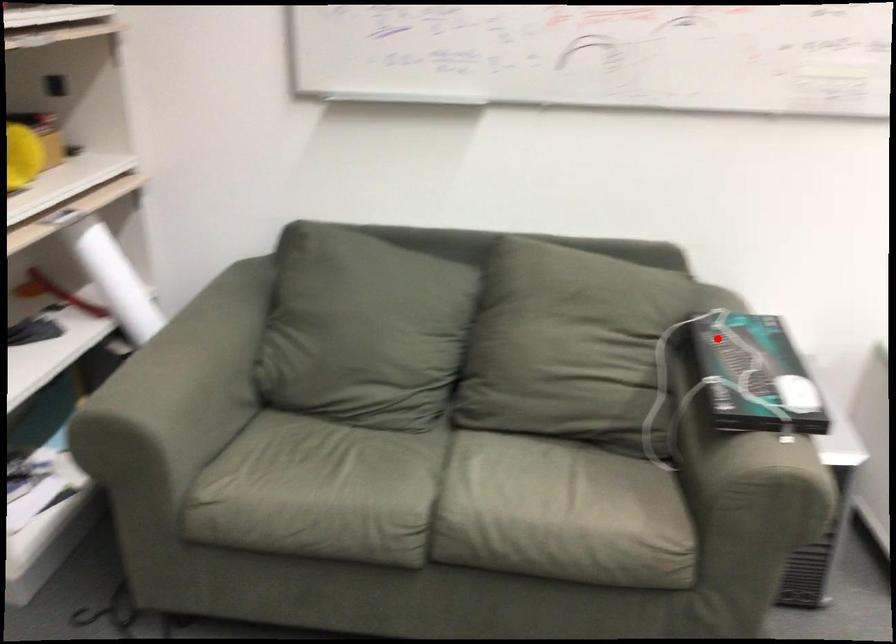
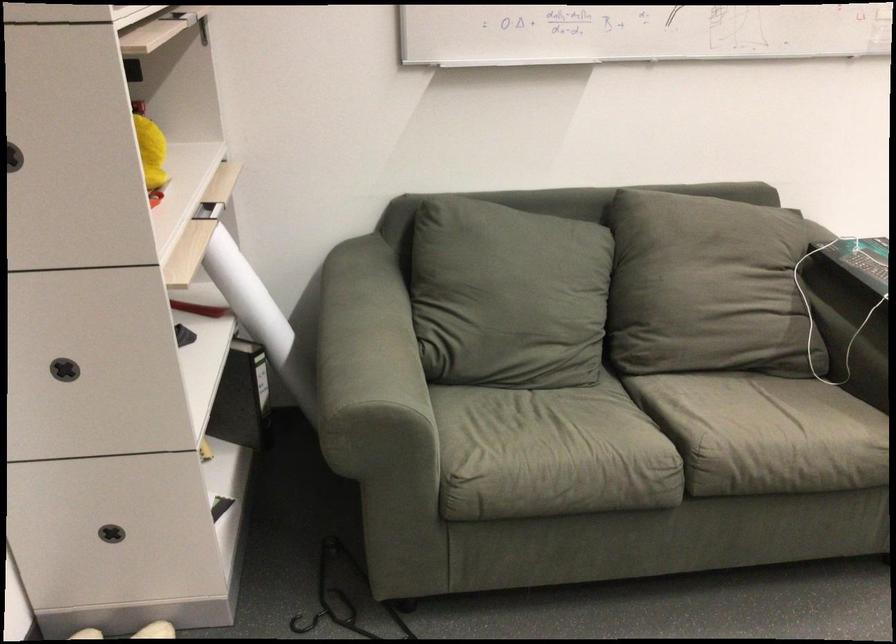
Find the pixel in the second image that matches the highlighted location in the first image.

(860, 259)